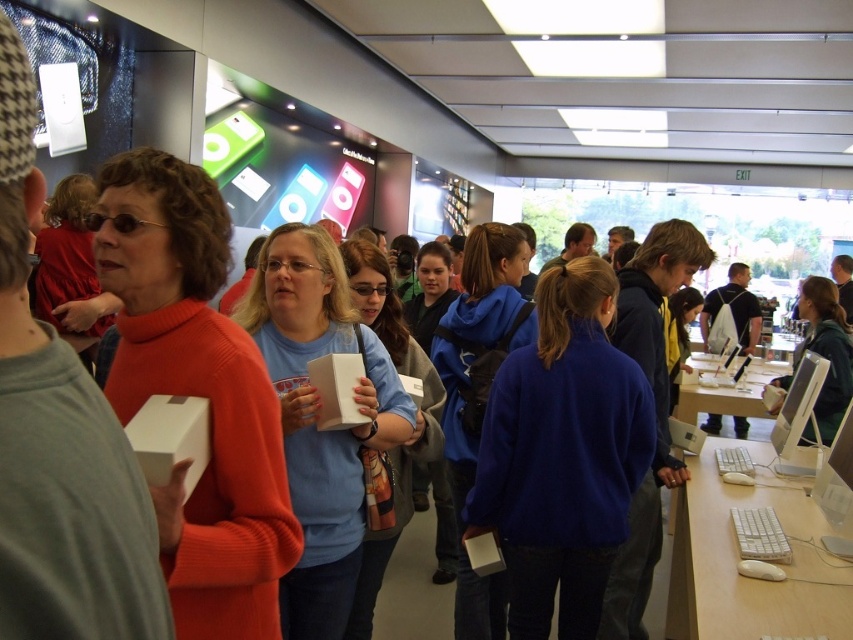
This screenshot has width=853, height=640. Identify the location of royal blue sweater at center. (561, 456).

Which is below, royal blue sweater at center or white matte box at center?

royal blue sweater at center

Locate an element on the screen. The height and width of the screenshot is (640, 853). royal blue sweater at center is located at coordinates [561, 456].